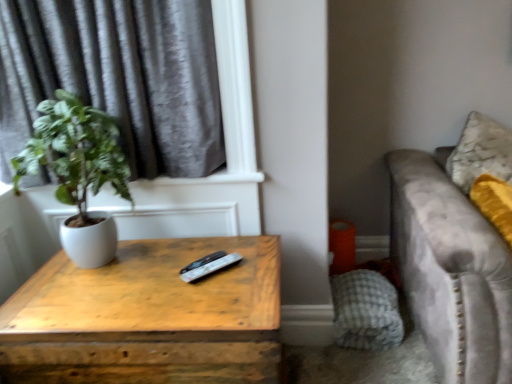
Find the location of `vacant area that lies to the right of black plastic remote at center`. vacant area that lies to the right of black plastic remote at center is located at coordinates (253, 266).